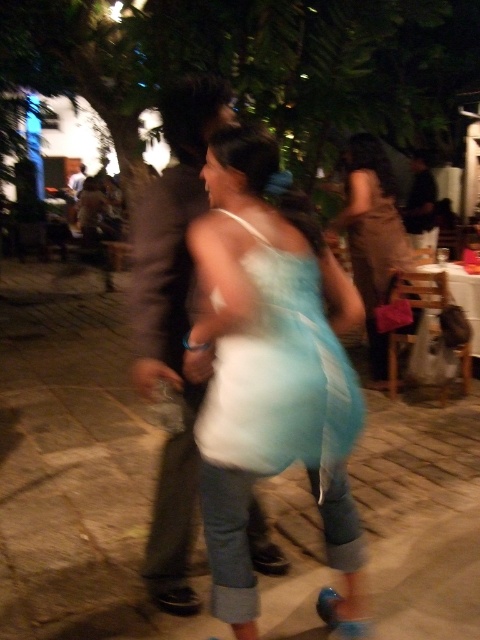
Question: Which point is farther to the camera?

Choices:
 (A) light blue satin dress at center
 (B) dark brown suit at center
 (C) light blue fabric dress at center

Answer: (B)

Question: Does light blue satin dress at center appear on the right side of matte brown dress at center?

Choices:
 (A) no
 (B) yes

Answer: (A)

Question: Is dark brown suit at center below light blue satin dress at center?

Choices:
 (A) yes
 (B) no

Answer: (B)

Question: Can you confirm if light blue fabric dress at center is positioned to the left of matte brown dress at center?

Choices:
 (A) no
 (B) yes

Answer: (B)

Question: Considering the real-world distances, which object is closest to the light blue satin dress at center?

Choices:
 (A) dark brown suit at center
 (B) light blue fabric dress at center

Answer: (B)

Question: Among these points, which one is nearest to the camera?

Choices:
 (A) (179, 276)
 (B) (218, 461)

Answer: (B)